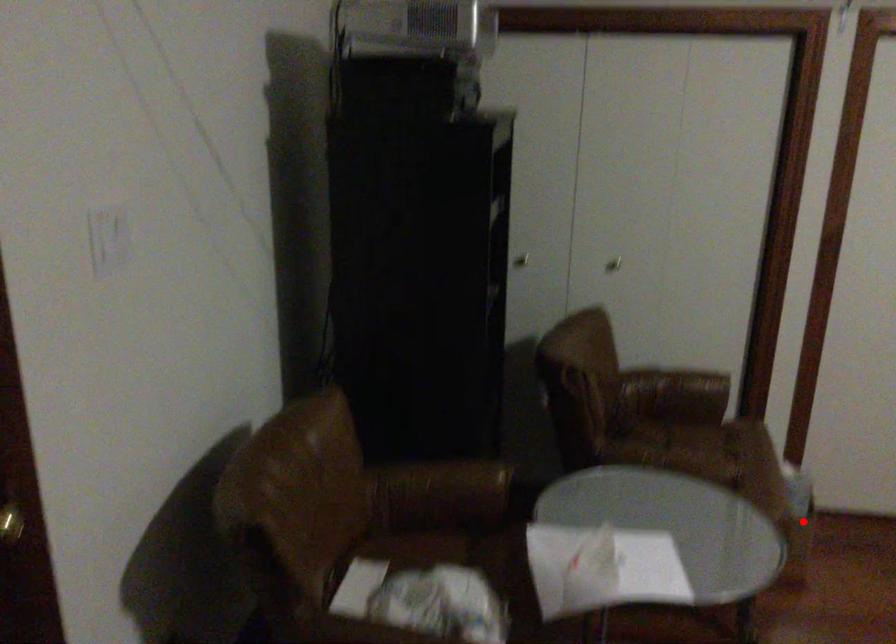
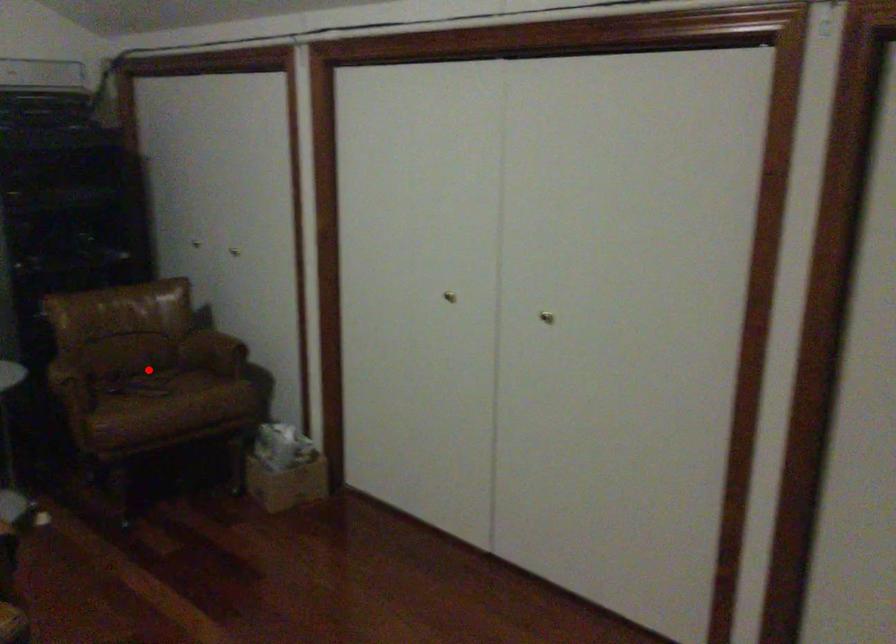
I am providing you with two images of the same scene from different viewpoints. A red point is marked on the first image and another point is marked on the second image. Does the point marked in image1 correspond to the same location as the one in image2?

No